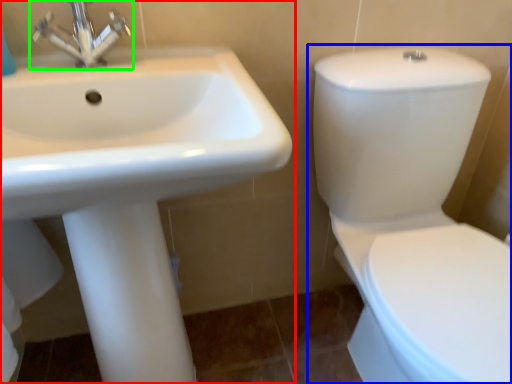
Question: Which object is the farthest from sink (highlighted by a red box)? Choose among these: toilet (highlighted by a blue box) or tap (highlighted by a green box).

Choices:
 (A) toilet
 (B) tap

Answer: (A)